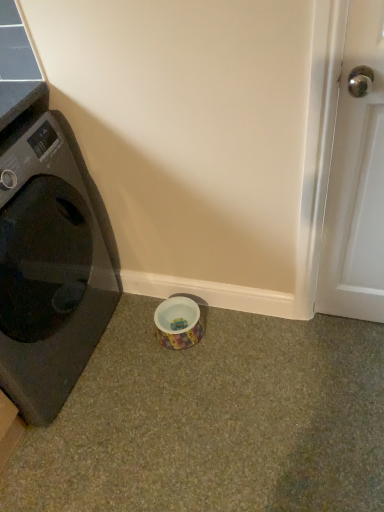
Question: Does point (170, 347) appear closer or farther from the camera than point (365, 34)?

Choices:
 (A) closer
 (B) farther

Answer: (B)

Question: Considering the positions of multicolored ceramic bowl at lower center and white glossy door handle at right in the image, is multicolored ceramic bowl at lower center wider or thinner than white glossy door handle at right?

Choices:
 (A) wide
 (B) thin

Answer: (A)

Question: Based on their relative distances, which object is farther from the white glossy door handle at right?

Choices:
 (A) multicolored ceramic bowl at lower center
 (B) black glossy washing machine at left

Answer: (B)

Question: Which object is positioned farthest from the black glossy washing machine at left?

Choices:
 (A) multicolored ceramic bowl at lower center
 (B) white glossy door handle at right

Answer: (B)